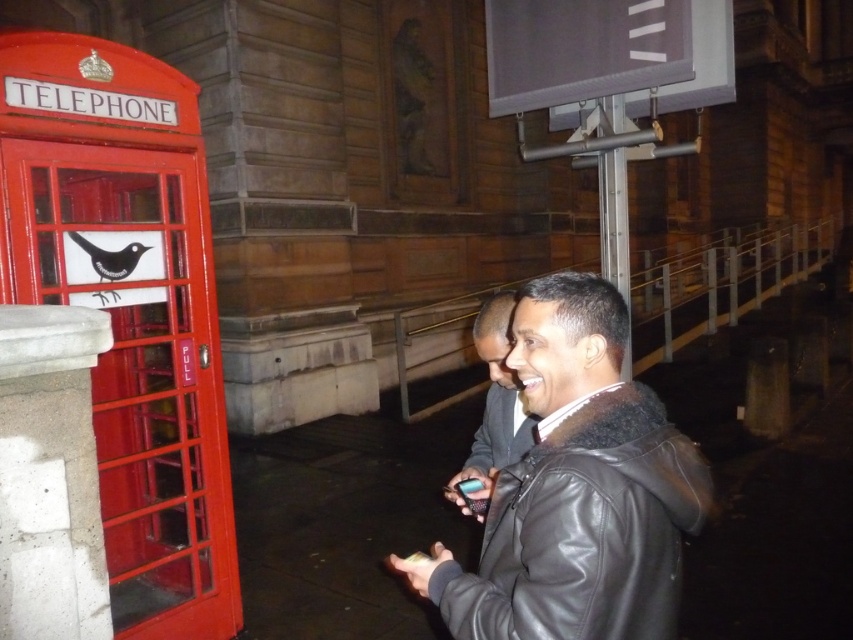
You are a person standing in the nighttime urban scene. There is a point at coordinates point [708,477]. Can you reach that point without moving your feet?

The distance of point [708,477] from viewer is 1.37 meters, so you cannot reach it without moving your feet because it is farther than your arm length.